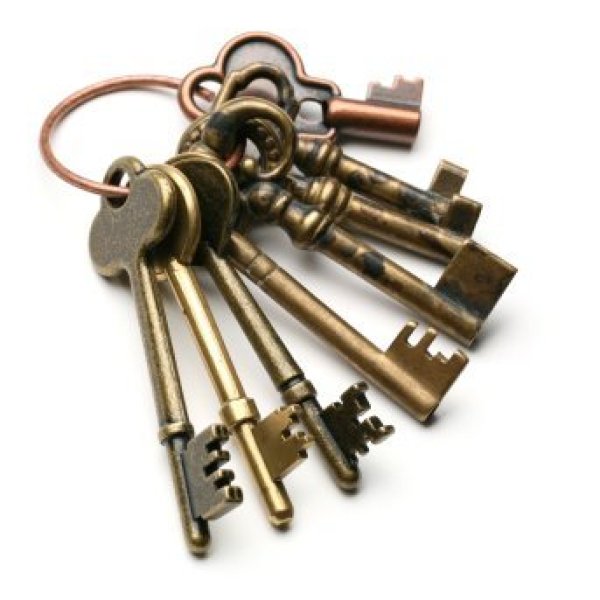
Where is `keys`? This screenshot has height=600, width=600. keys is located at coordinates (138, 242), (175, 240), (209, 200), (247, 251), (267, 202), (318, 195), (347, 169), (344, 111).